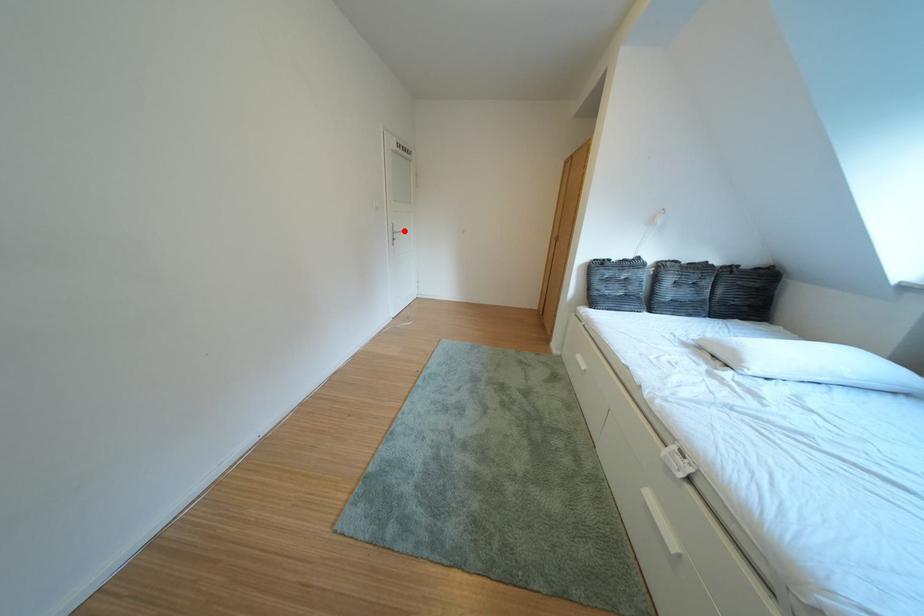
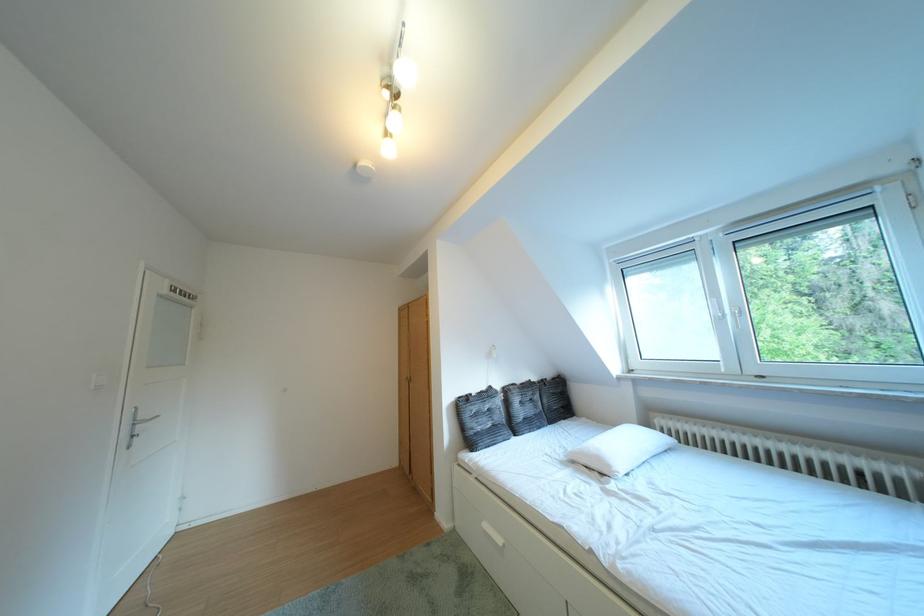
Locate, in the second image, the point that corresponds to the highlighted location in the first image.

(141, 418)